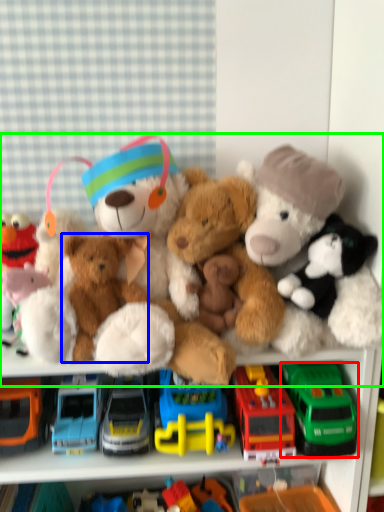
Question: Which object is positioned farthest from truck (highlighted by a red box)? Select from toy (highlighted by a blue box) and teddy bear (highlighted by a green box).

Choices:
 (A) toy
 (B) teddy bear

Answer: (A)